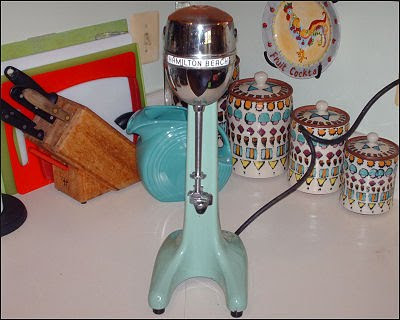
I want to click on knives, so click(40, 103).